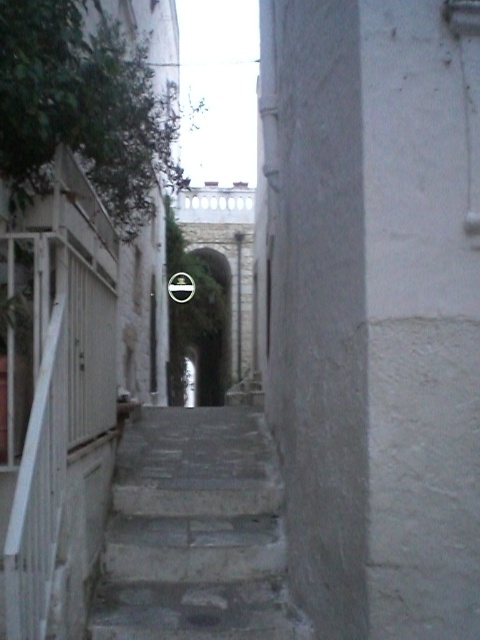
Does concrete stairs at center have a larger size compared to white matte rail at left?

Correct, concrete stairs at center is larger in size than white matte rail at left.

Who is more distant from viewer, (151, 452) or (55, 536)?

The point (151, 452) is behind.

What are the coordinates of `concrete stairs at center` in the screenshot? It's located at (194, 532).